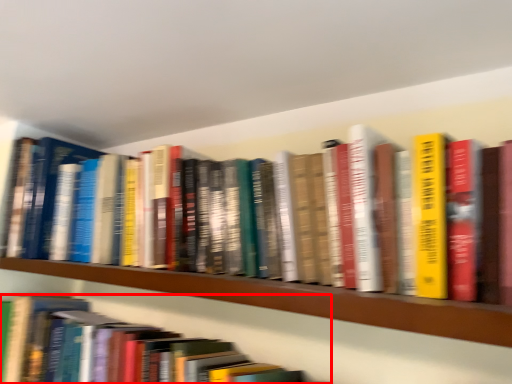
Question: Considering the relative positions of book (annotated by the red box) and shelf in the image provided, where is book (annotated by the red box) located with respect to the staircase?

Choices:
 (A) left
 (B) right

Answer: (A)